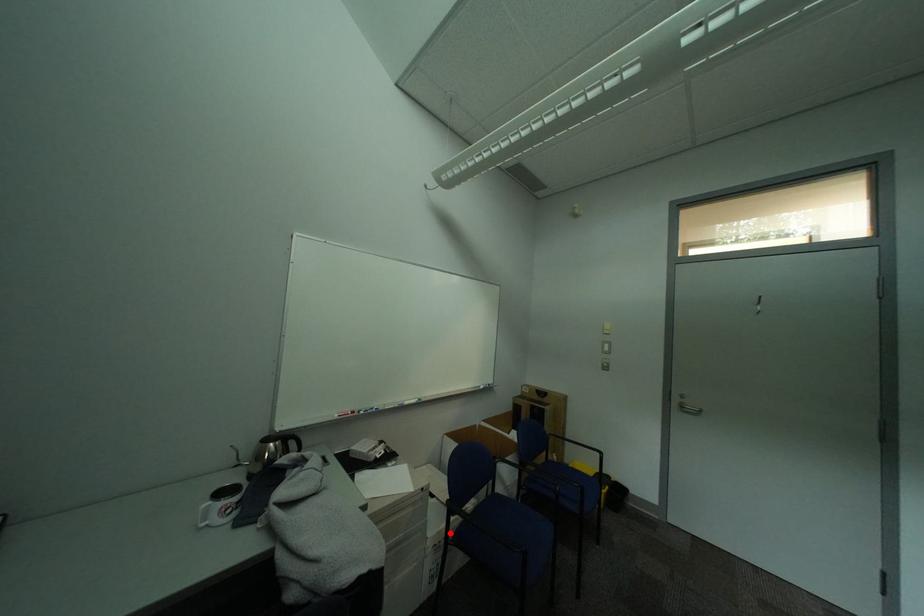
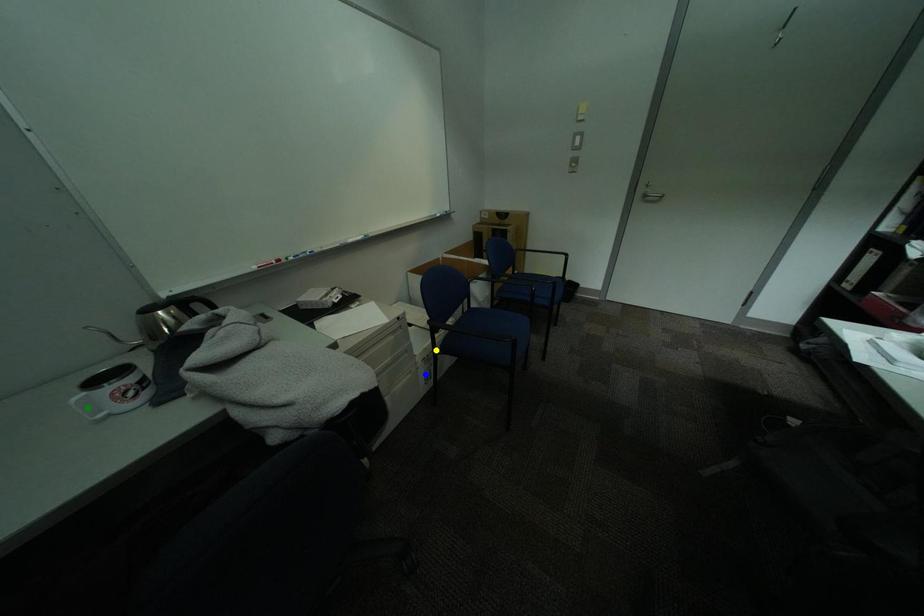
Question: I am providing you with two images of the same scene from different viewpoints. A red point is marked on the first image. You are given multiple points on the second image. Which point in image 2 is actually the same real-world point as the red point in image 1?

Choices:
 (A) yellow point
 (B) blue point
 (C) green point

Answer: (A)